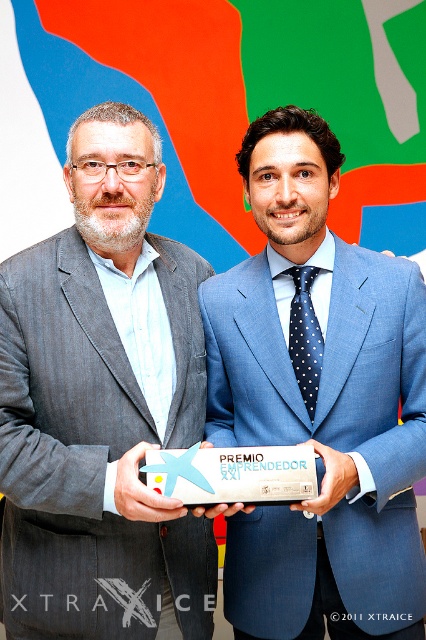
Who is taller, blue woolen suit at center or dark blue dotted tie at center?

Standing taller between the two is blue woolen suit at center.

Consider the image. Can you confirm if blue woolen suit at center is shorter than dark blue dotted tie at center?

Incorrect, blue woolen suit at center's height does not fall short of dark blue dotted tie at center's.

Does point (253, 515) come farther from viewer compared to point (302, 275)?

No, (253, 515) is in front of (302, 275).

You are a GUI agent. You are given a task and a screenshot of the screen. Output one action in this format:
    pyautogui.click(x=<x>, y=<y>)
    Task: Click on the blue woolen suit at center
    The width and height of the screenshot is (426, 640).
    Given the screenshot: What is the action you would take?
    pyautogui.click(x=336, y=412)

Does gray textured suit at left appear under dark blue dotted tie at center?

Correct, gray textured suit at left is located below dark blue dotted tie at center.

Is gray textured suit at left smaller than dark blue dotted tie at center?

No, gray textured suit at left is not smaller than dark blue dotted tie at center.

Find the location of a particular element. This screenshot has height=640, width=426. gray textured suit at left is located at coordinates (80, 465).

The image size is (426, 640). In order to click on gray textured suit at left in this screenshot , I will do `click(80, 465)`.

Can you confirm if white plastic plaque at center is wider than dark blue dotted tie at center?

Correct, the width of white plastic plaque at center exceeds that of dark blue dotted tie at center.

Does white plastic plaque at center have a lesser width compared to dark blue dotted tie at center?

No.

Image resolution: width=426 pixels, height=640 pixels. Describe the element at coordinates (233, 474) in the screenshot. I see `white plastic plaque at center` at that location.

The width and height of the screenshot is (426, 640). I want to click on white plastic plaque at center, so [x=233, y=474].